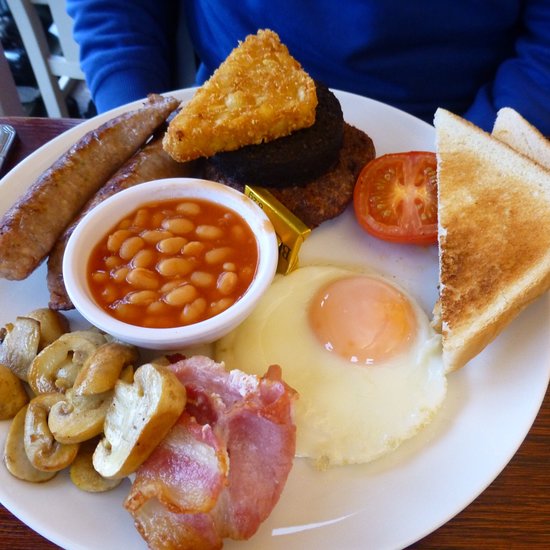
You are a GUI agent. You are given a task and a screenshot of the screen. Output one action in this format:
    pyautogui.click(x=<x>, y=<y>)
    Task: Click on the beams
    This screenshot has width=550, height=550.
    Given the screenshot: What is the action you would take?
    pyautogui.click(x=201, y=265)